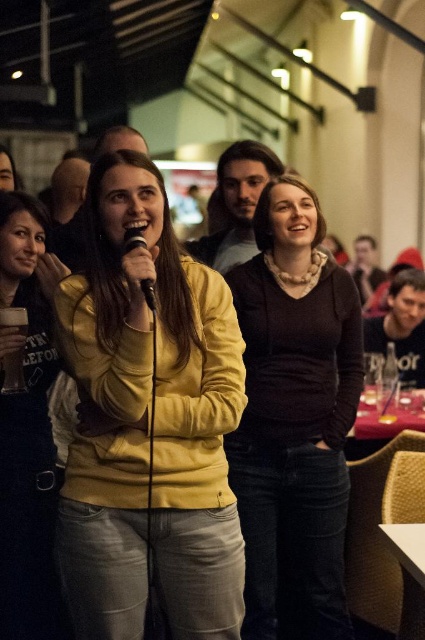
Question: Estimate the real-world distances between objects in this image. Which object is farther from the dark blue shirt at center?

Choices:
 (A) matte yellow sweater at center
 (B) dark brown sweater at center
 (C) yellow matte jacket at center

Answer: (A)

Question: Is dark brown sweater at center wider than white textured table at lower right?

Choices:
 (A) yes
 (B) no

Answer: (A)

Question: Which point is closer to the camera?

Choices:
 (A) yellow matte jacket at center
 (B) dark blue shirt at center

Answer: (A)

Question: Which object is positioned farthest from the dark blue shirt at center?

Choices:
 (A) dark brown sweater at center
 (B) yellow matte jacket at center

Answer: (B)

Question: From the image, what is the correct spatial relationship of yellow matte jacket at center in relation to smooth brown hair at center?

Choices:
 (A) below
 (B) above

Answer: (A)

Question: Does matte yellow sweater at center have a larger size compared to dark blue shirt at center?

Choices:
 (A) no
 (B) yes

Answer: (A)